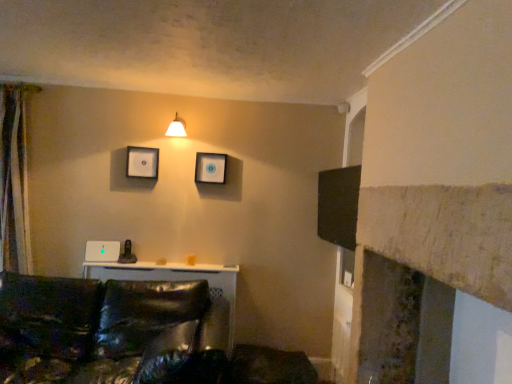
Question: From a real-world perspective, is matte plastic picture frame at upper center, placed as the 1th picture frame when sorted from right to left, physically located above or below silky beige curtain at left?

Choices:
 (A) below
 (B) above

Answer: (B)

Question: Is matte plastic picture frame at upper center, placed as the 1th picture frame when sorted from right to left, in front of or behind silky beige curtain at left in the image?

Choices:
 (A) behind
 (B) front

Answer: (A)

Question: Considering the real-world distances, which object is farthest from the matte white picture frame at upper center, the 2th picture frame from the right?

Choices:
 (A) matte plastic picture frame at upper center, which appears as the second picture frame when viewed from the left
 (B) silky beige curtain at left
 (C) matte white wall sconce at upper center
 (D) shiny black leather couch at lower left

Answer: (D)

Question: Based on their relative distances, which object is nearer to the matte white picture frame at upper center, the 2th picture frame from the right?

Choices:
 (A) matte plastic picture frame at upper center, placed as the 1th picture frame when sorted from right to left
 (B) shiny black leather couch at lower left
 (C) matte white wall sconce at upper center
 (D) silky beige curtain at left

Answer: (C)